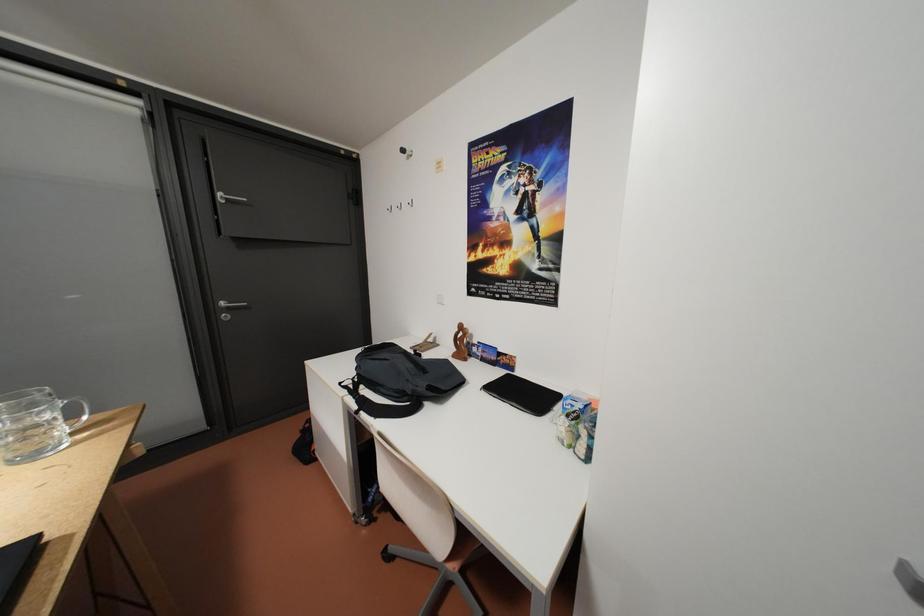
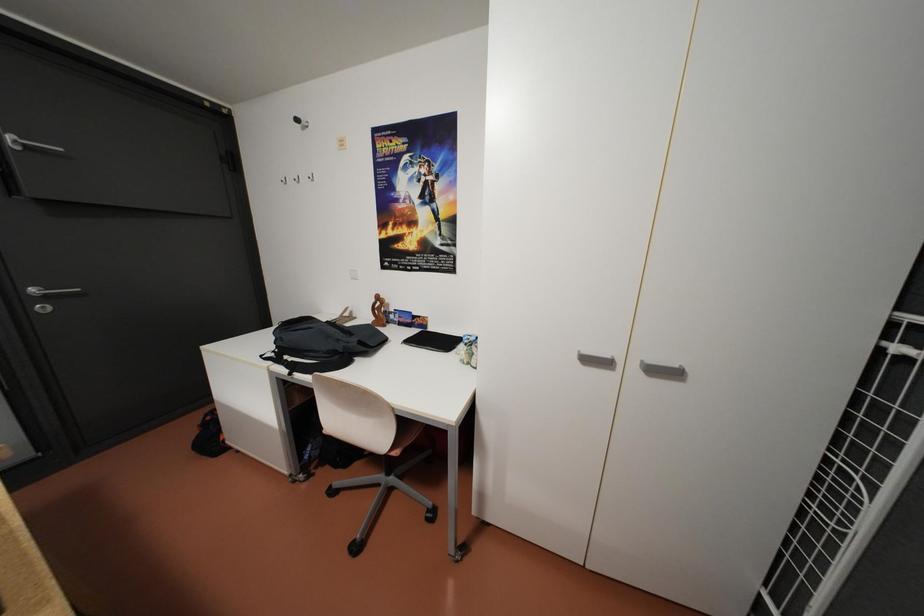
Question: The camera is either moving clockwise (left) or counter-clockwise (right) around the object. The first image is from the beginning of the video and the second image is from the end. Is the camera moving left or right when shooting the video?

Choices:
 (A) Left
 (B) Right

Answer: (A)